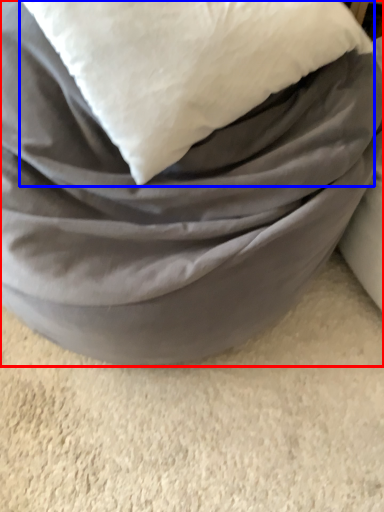
Question: Which point is closer to the camera, furniture (highlighted by a red box) or pillow (highlighted by a blue box)?

Choices:
 (A) furniture
 (B) pillow

Answer: (A)